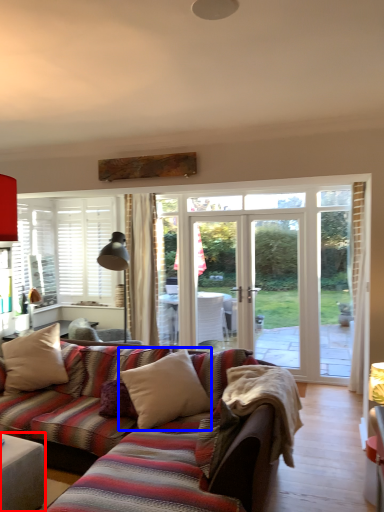
Question: Which object is further to the camera taking this photo, table (highlighted by a red box) or pillow (highlighted by a blue box)?

Choices:
 (A) table
 (B) pillow

Answer: (B)